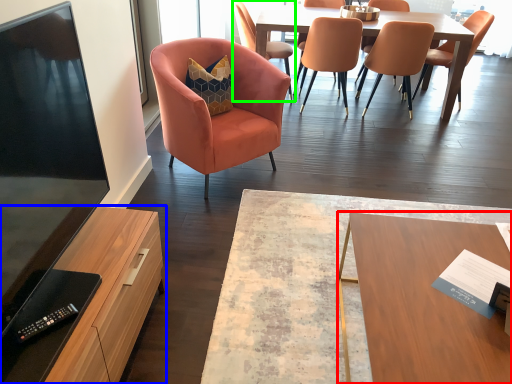
Question: Based on their relative distances, which object is nearer to desk (highlighted by a red box)? Choose from cabinetry (highlighted by a blue box) and chair (highlighted by a green box).

Choices:
 (A) cabinetry
 (B) chair

Answer: (A)